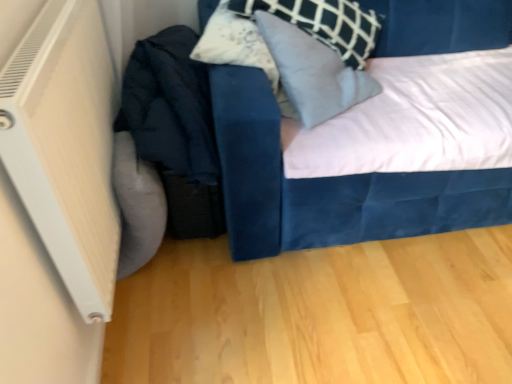
Question: Considering the positions of white plastic radiator at left and velvet blue bed at center in the image, is white plastic radiator at left bigger or smaller than velvet blue bed at center?

Choices:
 (A) small
 (B) big

Answer: (A)

Question: In the image, is white plastic radiator at left positioned in front of or behind velvet blue bed at center?

Choices:
 (A) behind
 (B) front

Answer: (B)

Question: Considering the real-world distances, which object is closest to the velvet blue pillow at upper center?

Choices:
 (A) velvet blue bed at center
 (B) white plastic radiator at left

Answer: (A)

Question: Estimate the real-world distances between objects in this image. Which object is closer to the velvet blue bed at center?

Choices:
 (A) velvet blue pillow at upper center
 (B) white plastic radiator at left

Answer: (A)